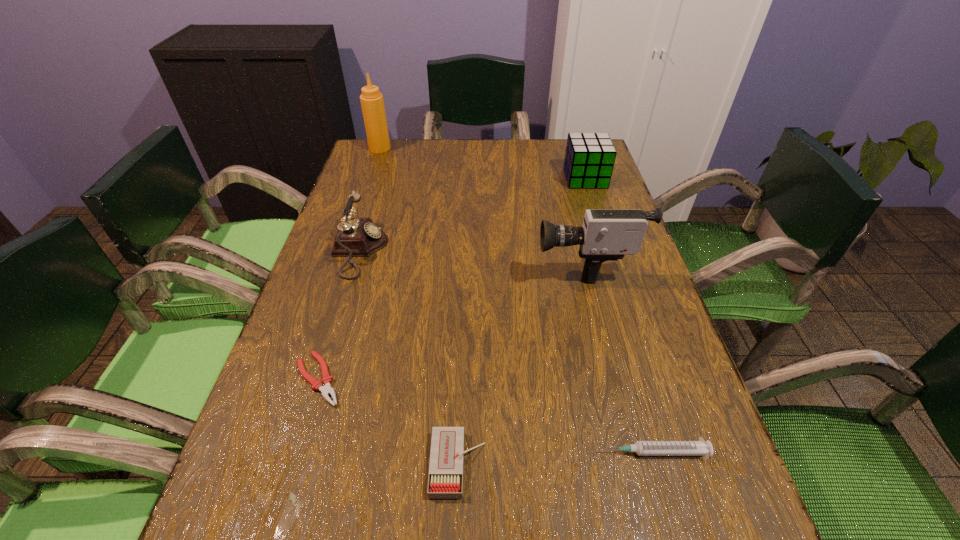
Locate an element on the screen. This screenshot has height=540, width=960. free space located 0.350m on the back of the pliers is located at coordinates (361, 240).

Find the location of `condiment that is at the far edge`. condiment that is at the far edge is located at coordinates coord(372,103).

Find the location of a particular element. cube at the far edge is located at coordinates (589, 159).

Where is `condiment that is positioned at the left edge`? The image size is (960, 540). condiment that is positioned at the left edge is located at coordinates (372, 103).

Image resolution: width=960 pixels, height=540 pixels. Find the location of `telephone present at the left edge`. telephone present at the left edge is located at coordinates (357, 237).

At what (x,y) coordinates should I click in order to perform the action: click on pliers that is at the left edge. Please return your answer as a coordinate pair (x, y). Looking at the image, I should click on (326, 390).

The height and width of the screenshot is (540, 960). Identify the location of camcorder present at the right edge. (606, 234).

Locate an element on the screen. The height and width of the screenshot is (540, 960). cube that is at the right edge is located at coordinates (589, 159).

Where is `syringe present at the right edge`? This screenshot has height=540, width=960. syringe present at the right edge is located at coordinates (642, 448).

In order to click on object that is positioned at the far left corner in this screenshot , I will do `click(372, 103)`.